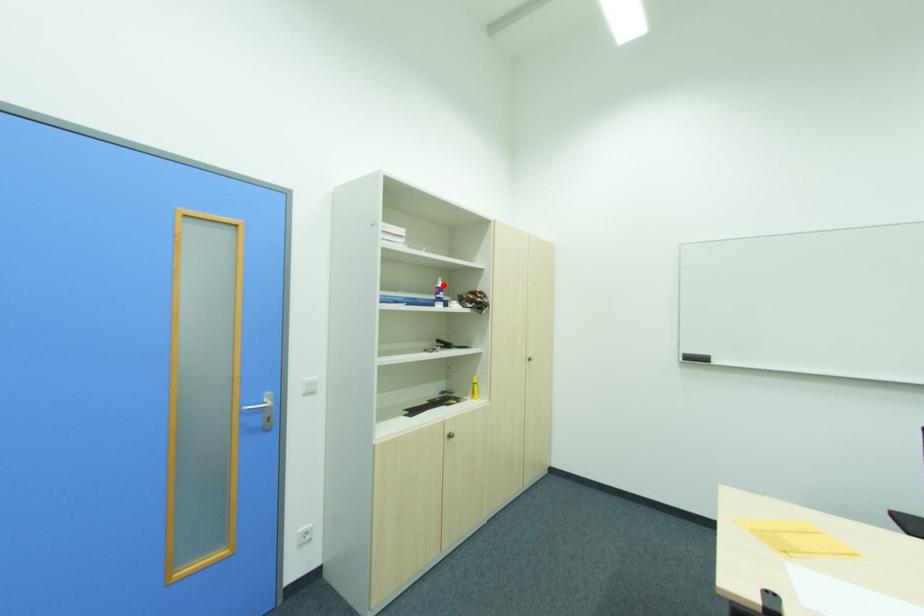
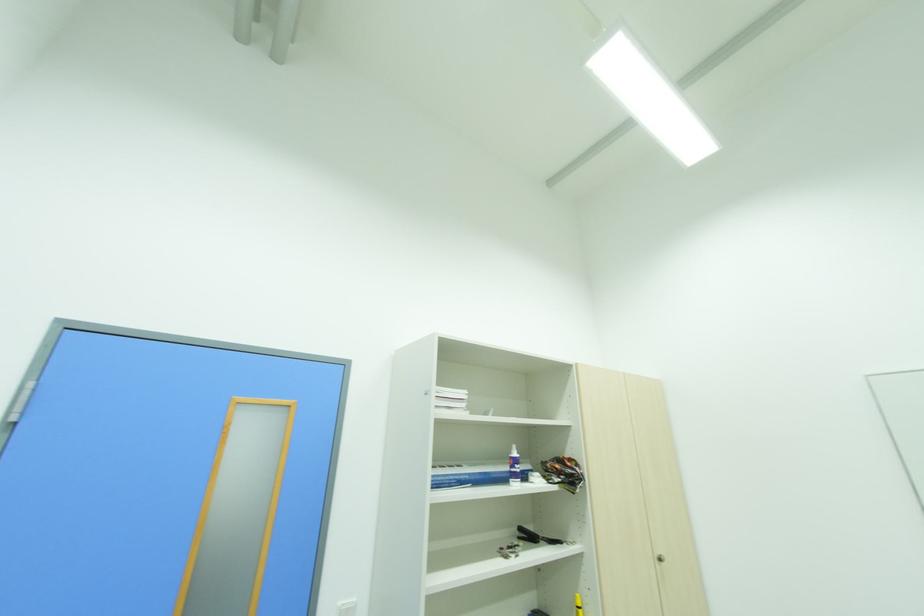
In the second image, find the point that corresponds to the highlighted location in the first image.

(517, 455)